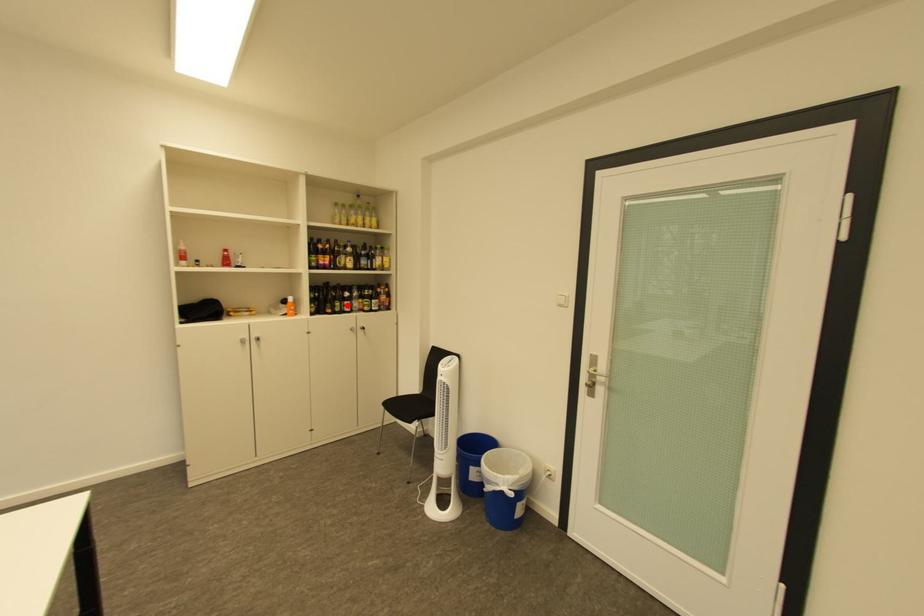
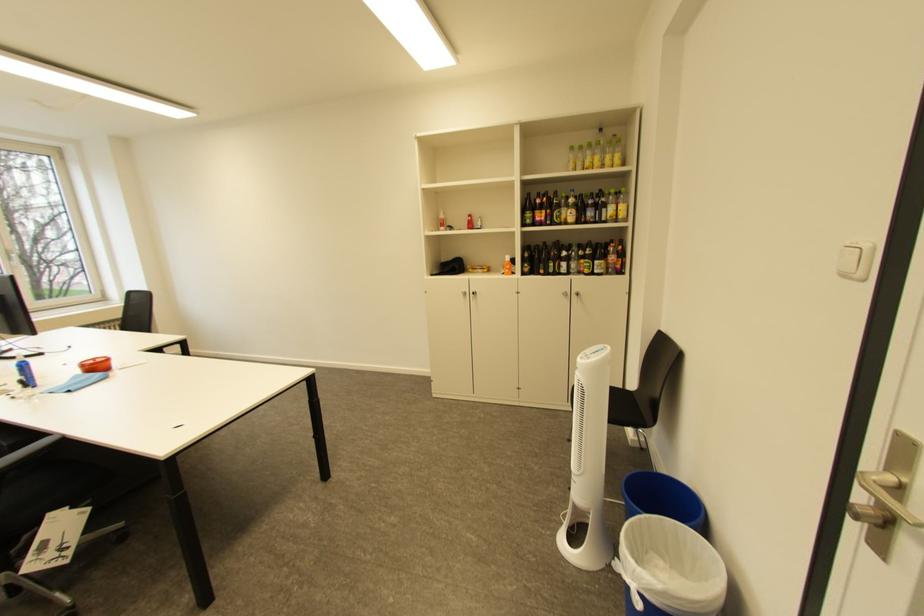
In the second image, find the point that corresponds to the highlighted location in the first image.

(562, 265)